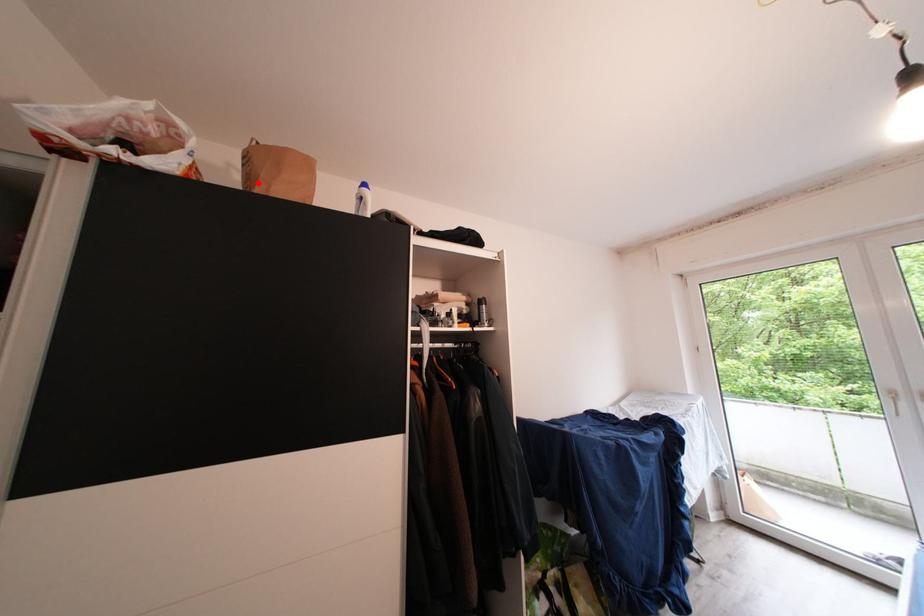
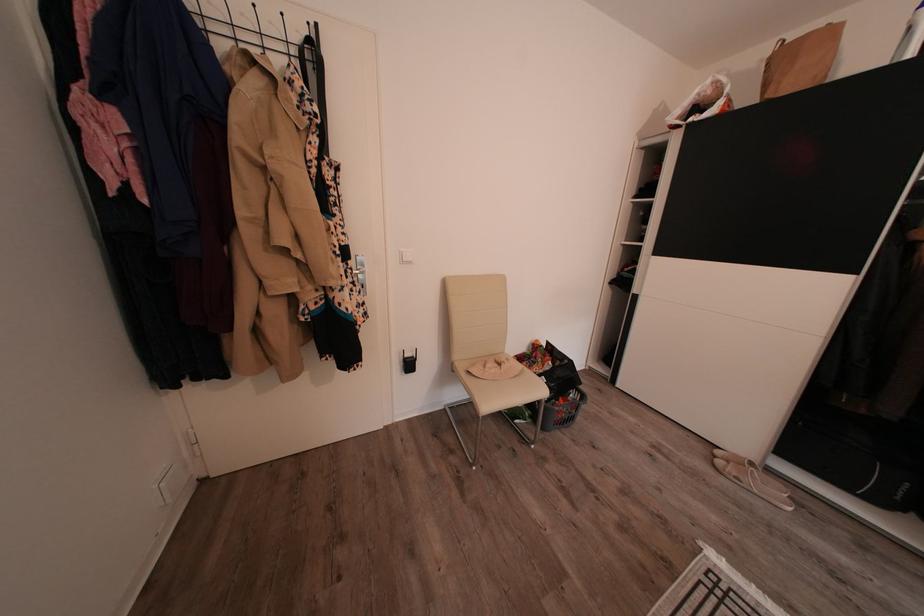
Question: I am providing you with two images of the same scene from different viewpoints. Given a red point in image1, look at the same physical point in image2. Is it:

Choices:
 (A) Closer to the viewpoint
 (B) Farther from the viewpoint

Answer: (B)